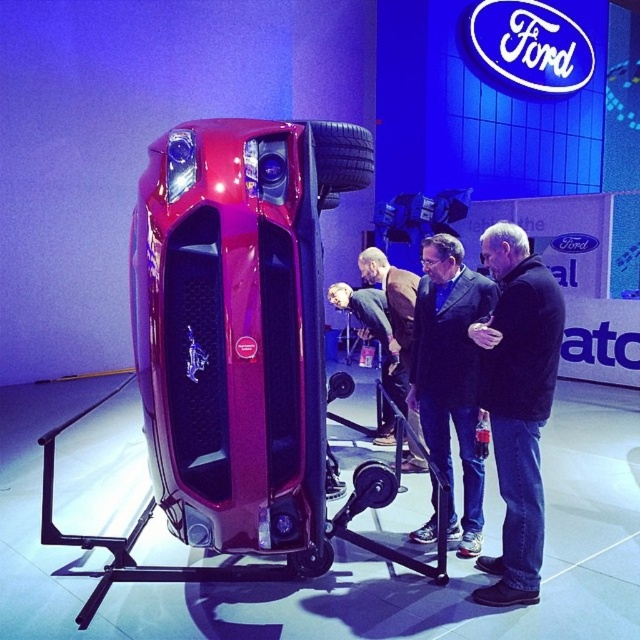
Is point (442, 452) positioned after point (289, 568)?

Yes, point (442, 452) is behind point (289, 568).

The image size is (640, 640). I want to click on dark blue suit at center, so click(x=451, y=374).

Measure the distance from dark blue suit at center to green fabric jacket at center.

A distance of 1.07 meters exists between dark blue suit at center and green fabric jacket at center.

Does dark blue suit at center have a greater height compared to green fabric jacket at center?

Indeed, dark blue suit at center has a greater height compared to green fabric jacket at center.

Find the location of a particular element. dark blue suit at center is located at coordinates (451, 374).

Is brown leather jacket at center further to the viewer compared to black rubber tire at upper center?

Yes, brown leather jacket at center is further from the viewer.

Does brown leather jacket at center have a lesser width compared to black rubber tire at upper center?

Incorrect, brown leather jacket at center's width is not less than black rubber tire at upper center's.

Between point (404, 276) and point (365, 141), which one is positioned behind?

The point (404, 276) is behind.

The height and width of the screenshot is (640, 640). What are the coordinates of `brown leather jacket at center` in the screenshot? It's located at (394, 300).